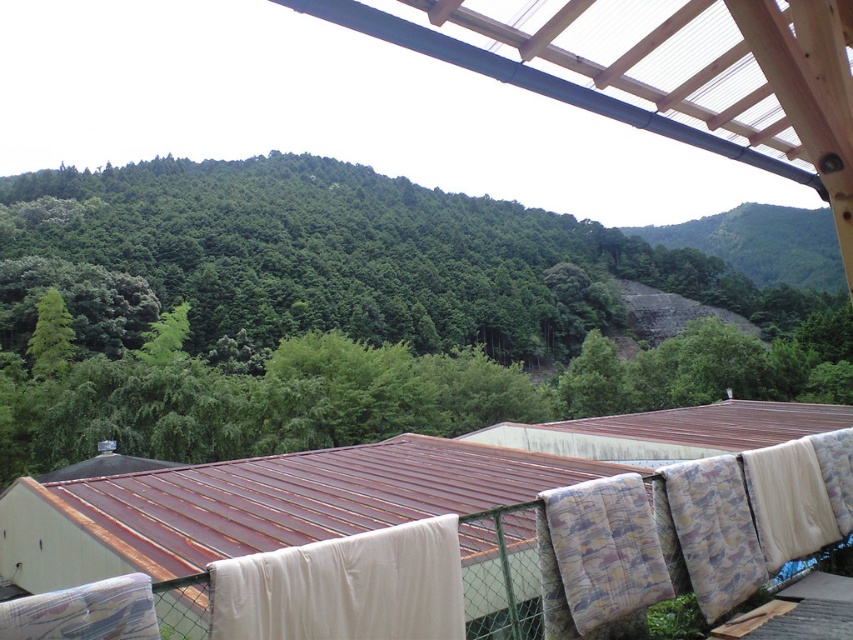
Question: Which of these objects is positioned closest to the green leafy tree at upper center?

Choices:
 (A) white fabric at lower center
 (B) rusty metal hut at lower left

Answer: (B)

Question: Among these objects, which one is farthest from the camera?

Choices:
 (A) white fabric at lower center
 (B) green leafy tree at upper center
 (C) rusty metal hut at lower left

Answer: (B)

Question: Is the position of green leafy tree at upper center more distant than that of rusty metal hut at lower left?

Choices:
 (A) no
 (B) yes

Answer: (B)

Question: Is green leafy tree at upper center positioned before white fabric at lower center?

Choices:
 (A) yes
 (B) no

Answer: (B)

Question: Can you confirm if rusty metal hut at lower left is positioned to the right of white fabric at lower center?

Choices:
 (A) yes
 (B) no

Answer: (A)

Question: Which of the following is the closest to the observer?

Choices:
 (A) (543, 417)
 (B) (448, 598)

Answer: (B)